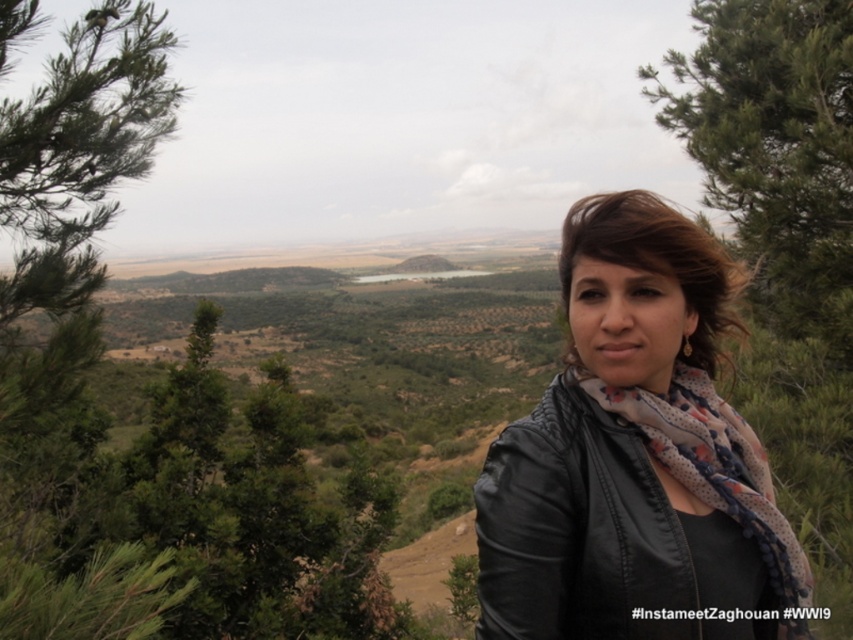
Question: Which point is closer to the camera taking this photo?

Choices:
 (A) (660, 460)
 (B) (625, 440)
 (C) (798, 147)

Answer: (B)

Question: Does matte black jacket at center appear over green leafy tree at upper right?

Choices:
 (A) yes
 (B) no

Answer: (B)

Question: Considering the relative positions of matte black jacket at center and green leafy tree at upper right in the image provided, where is matte black jacket at center located with respect to green leafy tree at upper right?

Choices:
 (A) left
 (B) right

Answer: (A)

Question: Among these points, which one is farthest from the camera?

Choices:
 (A) (585, 628)
 (B) (672, 116)
 (C) (718, 417)

Answer: (B)

Question: Estimate the real-world distances between objects in this image. Which object is closer to the green leafy tree at upper right?

Choices:
 (A) matte black jacket at center
 (B) floral-patterned scarf at center

Answer: (B)

Question: Is matte black jacket at center bigger than floral-patterned scarf at center?

Choices:
 (A) no
 (B) yes

Answer: (B)